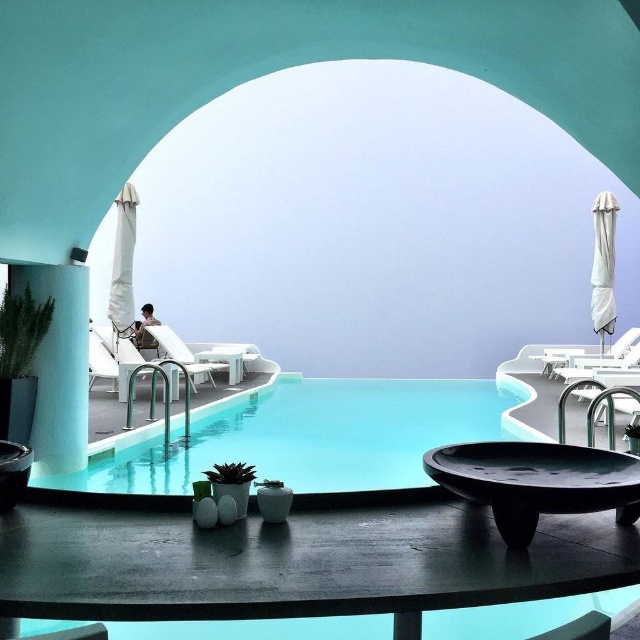
Question: Which is farther from the smooth dark wood table at lower center?

Choices:
 (A) matte blue pillar at left
 (B) matte black bowl at center

Answer: (A)

Question: Can you confirm if clear glass swimming pool at center is bigger than white plastic chair at center?

Choices:
 (A) no
 (B) yes

Answer: (A)

Question: Does matte black bowl at center come behind matte white table at center?

Choices:
 (A) yes
 (B) no

Answer: (B)

Question: Which of the following is the farthest from the observer?

Choices:
 (A) (237, 348)
 (B) (70, 296)

Answer: (A)

Question: From the image, what is the correct spatial relationship of smooth dark wood table at lower center in relation to white plastic chair at left?

Choices:
 (A) below
 (B) above

Answer: (A)

Question: Based on their relative distances, which object is nearer to the matte blue pillar at left?

Choices:
 (A) white plastic chair at center
 (B) matte black bowl at center
 (C) clear glass swimming pool at center
 (D) matte white table at center

Answer: (C)